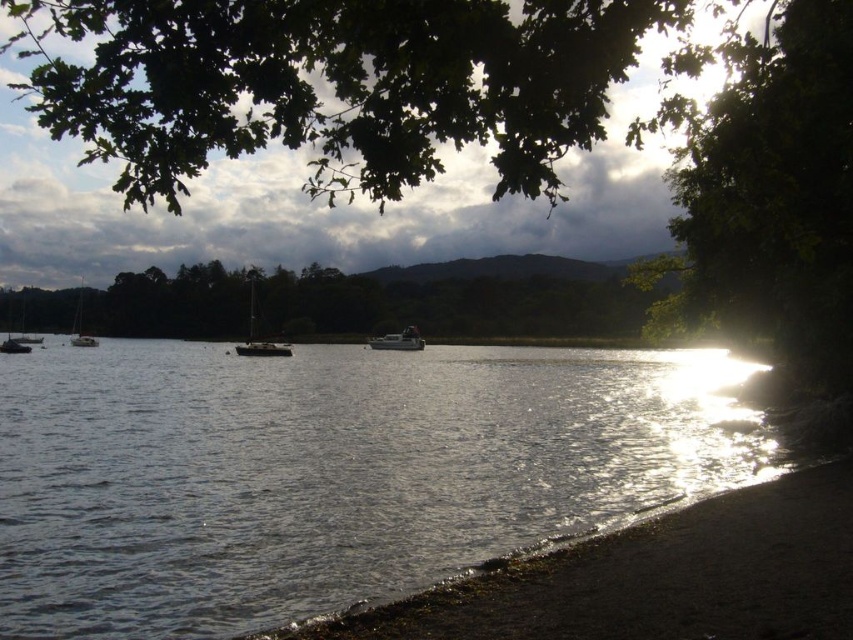
Question: Does green leafy branches at upper center appear over shiny silver sailboat at center?

Choices:
 (A) yes
 (B) no

Answer: (A)

Question: Which object is positioned closest to the green leafy branches at upper center?

Choices:
 (A) metallic gray boat at center
 (B) white glossy sailboat at left
 (C) glistening water at lower center
 (D) shiny silver sailboat at center

Answer: (C)

Question: Does green leafy branches at upper center have a smaller size compared to metallic silver sailboat at left?

Choices:
 (A) no
 (B) yes

Answer: (A)

Question: Considering the relative positions of shiny silver sailboat at center and metallic silver boat at lower left in the image provided, where is shiny silver sailboat at center located with respect to metallic silver boat at lower left?

Choices:
 (A) above
 (B) below

Answer: (A)

Question: Which object appears farthest from the camera in this image?

Choices:
 (A) white glossy sailboat at left
 (B) metallic gray boat at center
 (C) green leafy branches at upper center
 (D) metallic silver sailboat at left

Answer: (A)

Question: Which of the following is the closest to the observer?

Choices:
 (A) (19, 348)
 (B) (254, 285)
 (C) (412, 438)

Answer: (C)